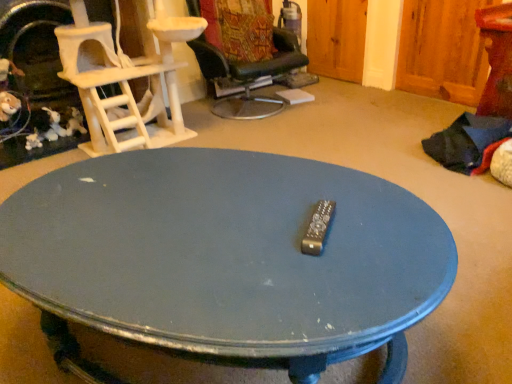
Locate an element on the screen. The width and height of the screenshot is (512, 384). blank space situated above blue painted wood coffee table at center (from a real-world perspective) is located at coordinates (202, 215).